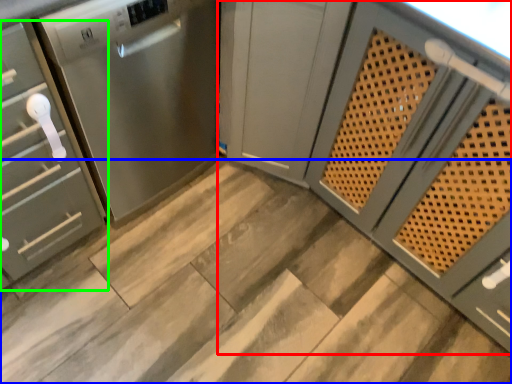
Question: Which is nearer to the cabinetry (highlighted by a red box)? stair (highlighted by a blue box) or cabinetry (highlighted by a green box).

Choices:
 (A) stair
 (B) cabinetry

Answer: (A)